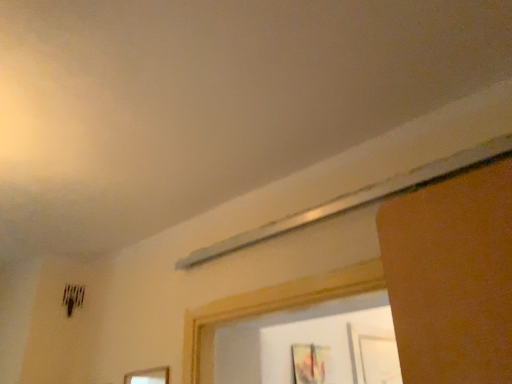
Consider the image. How much space does wooden picture frame at lower center, the 1th picture frame viewed from the left, occupy vertically?

wooden picture frame at lower center, the 1th picture frame viewed from the left, is 11.29 inches in height.

This screenshot has width=512, height=384. What do you see at coordinates (148, 376) in the screenshot?
I see `wooden picture frame at lower center, the 1th picture frame in the front-to-back sequence` at bounding box center [148, 376].

Where is `wooden picture frame at lower center, the 1th picture frame in the front-to-back sequence`? The height and width of the screenshot is (384, 512). wooden picture frame at lower center, the 1th picture frame in the front-to-back sequence is located at coordinates (148, 376).

In order to face matte wooden picture frame at lower right, the second picture frame from the left, should I rotate leftwards or rightwards?

To align with it, rotate right about 9.119°.

Where is `matte wooden picture frame at lower right, placed as the second picture frame when sorted from front to back`? This screenshot has height=384, width=512. matte wooden picture frame at lower right, placed as the second picture frame when sorted from front to back is located at coordinates (309, 363).

Describe the element at coordinates (309, 363) in the screenshot. I see `matte wooden picture frame at lower right, which is counted as the first picture frame, starting from the back` at that location.

Where is `wooden picture frame at lower center, which is the second picture frame in right-to-left order`? This screenshot has width=512, height=384. wooden picture frame at lower center, which is the second picture frame in right-to-left order is located at coordinates (148, 376).

Can you confirm if matte wooden picture frame at lower right, acting as the 1th picture frame starting from the right, is positioned to the right of wooden picture frame at lower center, arranged as the 2th picture frame when viewed from the back?

Correct, you'll find matte wooden picture frame at lower right, acting as the 1th picture frame starting from the right, to the right of wooden picture frame at lower center, arranged as the 2th picture frame when viewed from the back.

Which object is further away from the camera, matte wooden picture frame at lower right, acting as the 1th picture frame starting from the right, or wooden picture frame at lower center, which is the second picture frame in right-to-left order?

matte wooden picture frame at lower right, acting as the 1th picture frame starting from the right, is behind.

Which is behind, point (293, 377) or point (166, 368)?

The point (293, 377) is behind.

Consider the image. From the image's perspective, which is above, matte wooden picture frame at lower right, the second picture frame from the left, or wooden picture frame at lower center, arranged as the 2th picture frame when viewed from the back?

wooden picture frame at lower center, arranged as the 2th picture frame when viewed from the back, appears higher in the image.

From a real-world perspective, is matte wooden picture frame at lower right, the second picture frame from the left, located beneath wooden picture frame at lower center, which is the second picture frame in right-to-left order?

Incorrect, from a real-world perspective, matte wooden picture frame at lower right, the second picture frame from the left, is higher than wooden picture frame at lower center, which is the second picture frame in right-to-left order.

Considering the sizes of matte wooden picture frame at lower right, placed as the second picture frame when sorted from front to back, and wooden picture frame at lower center, arranged as the 2th picture frame when viewed from the back, in the image, is matte wooden picture frame at lower right, placed as the second picture frame when sorted from front to back, wider or thinner than wooden picture frame at lower center, arranged as the 2th picture frame when viewed from the back,?

In the image, matte wooden picture frame at lower right, placed as the second picture frame when sorted from front to back, appears to be wider than wooden picture frame at lower center, arranged as the 2th picture frame when viewed from the back.

Considering the sizes of objects matte wooden picture frame at lower right, placed as the second picture frame when sorted from front to back, and wooden picture frame at lower center, which is the second picture frame in right-to-left order, in the image provided, who is taller, matte wooden picture frame at lower right, placed as the second picture frame when sorted from front to back, or wooden picture frame at lower center, which is the second picture frame in right-to-left order,?

Standing taller between the two is matte wooden picture frame at lower right, placed as the second picture frame when sorted from front to back.

Who is bigger, matte wooden picture frame at lower right, which is counted as the first picture frame, starting from the back, or wooden picture frame at lower center, which is the second picture frame in right-to-left order?

matte wooden picture frame at lower right, which is counted as the first picture frame, starting from the back.

Is wooden picture frame at lower center, arranged as the 2th picture frame when viewed from the back, located within matte wooden picture frame at lower right, which is counted as the first picture frame, starting from the back?

Actually, wooden picture frame at lower center, arranged as the 2th picture frame when viewed from the back, is outside matte wooden picture frame at lower right, which is counted as the first picture frame, starting from the back.

Is matte wooden picture frame at lower right, which is counted as the first picture frame, starting from the back, not close to wooden picture frame at lower center, the 1th picture frame in the front-to-back sequence?

They are positioned close to each other.

Could you tell me if matte wooden picture frame at lower right, which is counted as the first picture frame, starting from the back, is turned towards wooden picture frame at lower center, the 1th picture frame in the front-to-back sequence?

No, matte wooden picture frame at lower right, which is counted as the first picture frame, starting from the back, is not facing towards wooden picture frame at lower center, the 1th picture frame in the front-to-back sequence.

How far apart are matte wooden picture frame at lower right, acting as the 1th picture frame starting from the right, and wooden picture frame at lower center, the 1th picture frame in the front-to-back sequence?

They are 68.50 centimeters apart.

You are a GUI agent. You are given a task and a screenshot of the screen. Output one action in this format:
    pyautogui.click(x=<x>, y=<y>)
    Task: Click on the picture frame below the matte wooden picture frame at lower right, the second picture frame from the left (from a real-world perspective)
    The width and height of the screenshot is (512, 384).
    Given the screenshot: What is the action you would take?
    pyautogui.click(x=148, y=376)

Considering the relative positions of wooden picture frame at lower center, the 1th picture frame viewed from the left, and matte wooden picture frame at lower right, placed as the second picture frame when sorted from front to back, in the image provided, is wooden picture frame at lower center, the 1th picture frame viewed from the left, to the right of matte wooden picture frame at lower right, placed as the second picture frame when sorted from front to back, from the viewer's perspective?

Incorrect, wooden picture frame at lower center, the 1th picture frame viewed from the left, is not on the right side of matte wooden picture frame at lower right, placed as the second picture frame when sorted from front to back.

Considering the positions of objects wooden picture frame at lower center, the 1th picture frame viewed from the left, and matte wooden picture frame at lower right, placed as the second picture frame when sorted from front to back, in the image provided, who is in front, wooden picture frame at lower center, the 1th picture frame viewed from the left, or matte wooden picture frame at lower right, placed as the second picture frame when sorted from front to back,?

wooden picture frame at lower center, the 1th picture frame viewed from the left, is in front.

Is point (166, 369) positioned after point (297, 371)?

No.

From the image's perspective, is wooden picture frame at lower center, the 1th picture frame viewed from the left, on top of matte wooden picture frame at lower right, which is counted as the first picture frame, starting from the back?

Yes, from the image's perspective, wooden picture frame at lower center, the 1th picture frame viewed from the left, is above matte wooden picture frame at lower right, which is counted as the first picture frame, starting from the back.

From a real-world perspective, is wooden picture frame at lower center, arranged as the 2th picture frame when viewed from the back, physically located above or below matte wooden picture frame at lower right, which is counted as the first picture frame, starting from the back?

From a real-world perspective, wooden picture frame at lower center, arranged as the 2th picture frame when viewed from the back, is physically below matte wooden picture frame at lower right, which is counted as the first picture frame, starting from the back.

Looking at their sizes, would you say wooden picture frame at lower center, the 1th picture frame viewed from the left, is wider or thinner than matte wooden picture frame at lower right, placed as the second picture frame when sorted from front to back?

In the image, wooden picture frame at lower center, the 1th picture frame viewed from the left, appears to be more narrow than matte wooden picture frame at lower right, placed as the second picture frame when sorted from front to back.

Looking at this image, does wooden picture frame at lower center, the 1th picture frame in the front-to-back sequence, have a lesser height compared to matte wooden picture frame at lower right, the second picture frame from the left?

Yes.

Which of these two, wooden picture frame at lower center, arranged as the 2th picture frame when viewed from the back, or matte wooden picture frame at lower right, the second picture frame from the left, is smaller?

wooden picture frame at lower center, arranged as the 2th picture frame when viewed from the back.

Is wooden picture frame at lower center, the 1th picture frame in the front-to-back sequence, positioned beyond the bounds of matte wooden picture frame at lower right, placed as the second picture frame when sorted from front to back?

wooden picture frame at lower center, the 1th picture frame in the front-to-back sequence, lies outside matte wooden picture frame at lower right, placed as the second picture frame when sorted from front to back,'s area.

Is wooden picture frame at lower center, the 1th picture frame in the front-to-back sequence, positioned far away from matte wooden picture frame at lower right, placed as the second picture frame when sorted from front to back?

No, wooden picture frame at lower center, the 1th picture frame in the front-to-back sequence, is not far away from matte wooden picture frame at lower right, placed as the second picture frame when sorted from front to back.

In the scene shown: Does wooden picture frame at lower center, arranged as the 2th picture frame when viewed from the back, turn towards matte wooden picture frame at lower right, placed as the second picture frame when sorted from front to back?

No.

Can you tell me how much wooden picture frame at lower center, which is the second picture frame in right-to-left order, and matte wooden picture frame at lower right, the second picture frame from the left, differ in facing direction?

There is a 90.4-degree angle between the facing directions of wooden picture frame at lower center, which is the second picture frame in right-to-left order, and matte wooden picture frame at lower right, the second picture frame from the left.

Measure the distance between wooden picture frame at lower center, the 1th picture frame viewed from the left, and matte wooden picture frame at lower right, which is counted as the first picture frame, starting from the back.

wooden picture frame at lower center, the 1th picture frame viewed from the left, is 26.97 inches from matte wooden picture frame at lower right, which is counted as the first picture frame, starting from the back.

Identify the location of picture frame that appears above the matte wooden picture frame at lower right, which is counted as the first picture frame, starting from the back (from the image's perspective). click(x=148, y=376).

Where is `picture frame above the matte wooden picture frame at lower right, placed as the second picture frame when sorted from front to back (from the image's perspective)`? Image resolution: width=512 pixels, height=384 pixels. picture frame above the matte wooden picture frame at lower right, placed as the second picture frame when sorted from front to back (from the image's perspective) is located at coordinates (148, 376).

Find the location of `picture frame behind the wooden picture frame at lower center, the 1th picture frame viewed from the left`. picture frame behind the wooden picture frame at lower center, the 1th picture frame viewed from the left is located at coordinates (309, 363).